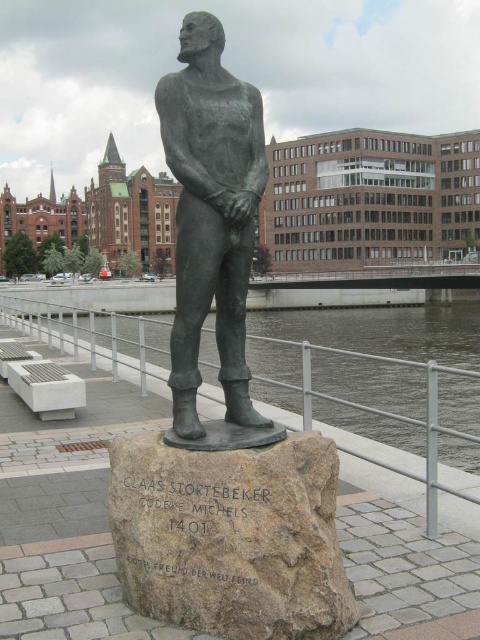
Is point (265, 481) closer to camera compared to point (164, 83)?

Yes, it is.

Locate an element on the screen. The image size is (480, 640). brown stone at center is located at coordinates (231, 538).

You are a GUI agent. You are given a task and a screenshot of the screen. Output one action in this format:
    pyautogui.click(x=<x>, y=<y>)
    Task: Click on the brown stone at center
    The height and width of the screenshot is (640, 480).
    Given the screenshot: What is the action you would take?
    pyautogui.click(x=231, y=538)

Where is `brown stone at center`? brown stone at center is located at coordinates (231, 538).

Does brown stone at center have a greater width compared to clear water at statue right?

No, brown stone at center is not wider than clear water at statue right.

Is point (210, 612) positioned behind point (354, 403)?

No, (210, 612) is in front of (354, 403).

Is point (171, 612) closer to viewer compared to point (206, 369)?

That is True.

Find the location of a particular element. brown stone at center is located at coordinates (231, 538).

Is point (202, 304) closer to viewer compared to point (472, 435)?

Yes, point (202, 304) is closer to viewer.

Between bronze statue at center and clear water at statue right, which one has more height?

bronze statue at center

Between point (220, 280) and point (124, 333), which one is positioned behind?

The point (124, 333) is behind.

Where is `bronze statue at center`? This screenshot has width=480, height=640. bronze statue at center is located at coordinates (212, 216).